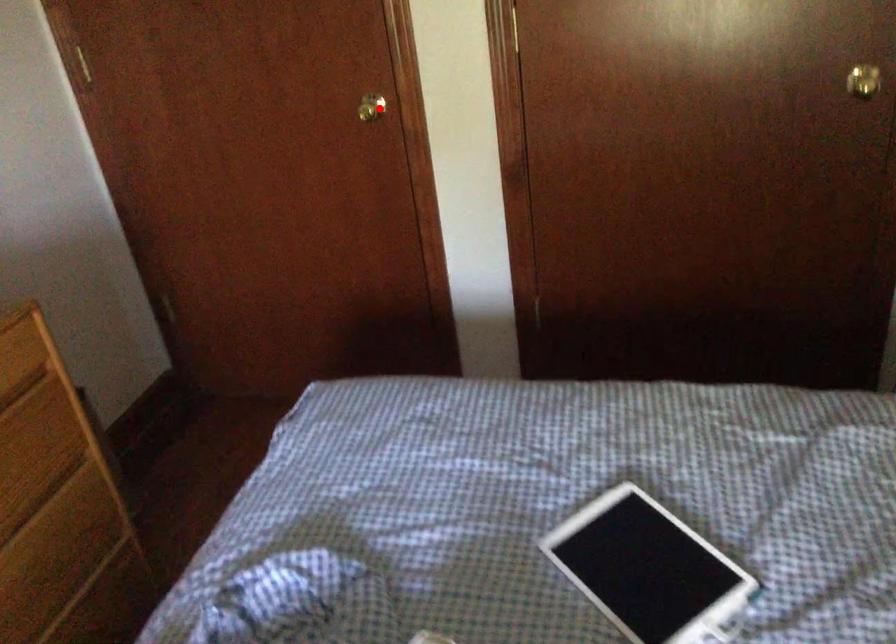
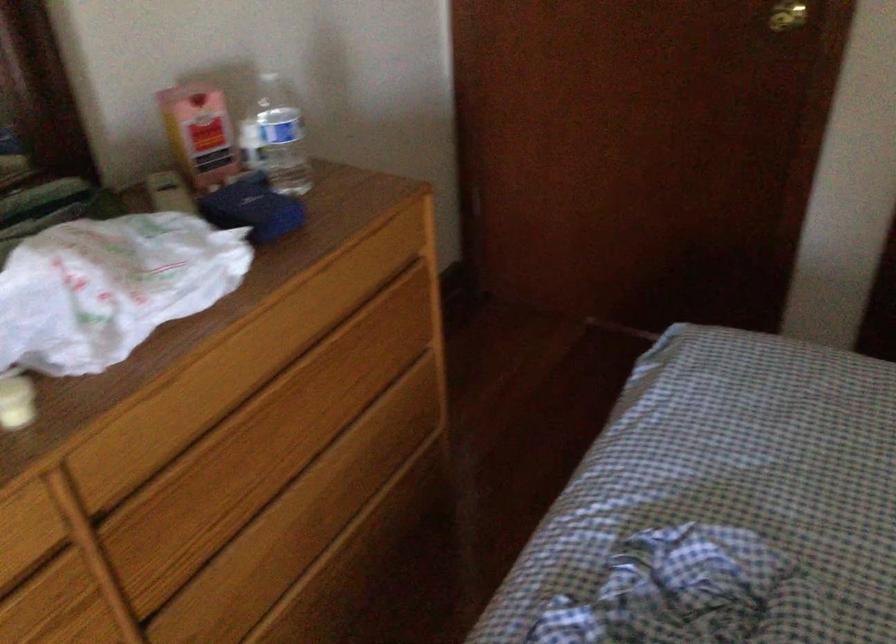
Question: I am providing you with two images of the same scene from different viewpoints. Image1 has a red point marked. In image2, the corresponding 3D location appears at what relative position? Reply with the corresponding letter.

Choices:
 (A) Closer
 (B) Farther

Answer: (A)